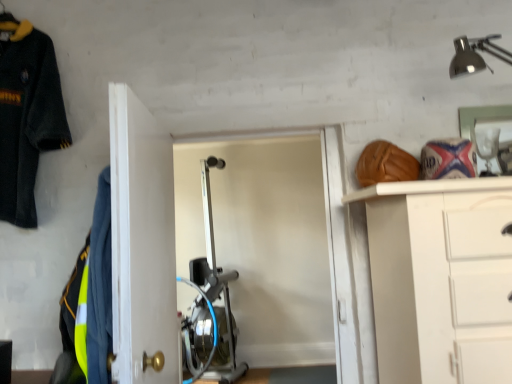
Question: Does dark blue fleece jacket at upper left, which ranks as the first uniform in back-to-front order, have a smaller size compared to reflective yellow-green fabric at left, the first uniform in the front-to-back sequence?

Choices:
 (A) no
 (B) yes

Answer: (A)

Question: Can you confirm if dark blue fleece jacket at upper left, the second uniform positioned from the right, is wider than reflective yellow-green fabric at left, the first uniform in the front-to-back sequence?

Choices:
 (A) no
 (B) yes

Answer: (B)

Question: Are dark blue fleece jacket at upper left, which ranks as the first uniform in back-to-front order, and reflective yellow-green fabric at left, the 2th uniform positioned from the back, located far from each other?

Choices:
 (A) no
 (B) yes

Answer: (A)

Question: Is dark blue fleece jacket at upper left, positioned as the first uniform in left-to-right order, looking in the opposite direction of reflective yellow-green fabric at left, the 1th uniform when ordered from right to left?

Choices:
 (A) no
 (B) yes

Answer: (A)

Question: Considering the relative positions of dark blue fleece jacket at upper left, positioned as the first uniform in left-to-right order, and reflective yellow-green fabric at left, which ranks as the second uniform in left-to-right order, in the image provided, is dark blue fleece jacket at upper left, positioned as the first uniform in left-to-right order, to the right of reflective yellow-green fabric at left, which ranks as the second uniform in left-to-right order, from the viewer's perspective?

Choices:
 (A) no
 (B) yes

Answer: (A)

Question: Would you say white glossy door at center is inside or outside reflective yellow-green fabric at left, arranged as the second uniform when viewed from the top?

Choices:
 (A) inside
 (B) outside

Answer: (B)

Question: From the image's perspective, is white glossy door at center positioned above or below reflective yellow-green fabric at left, which ranks as the second uniform in left-to-right order?

Choices:
 (A) below
 (B) above

Answer: (B)

Question: Based on their positions, is white glossy door at center located to the left or right of reflective yellow-green fabric at left, the 2th uniform positioned from the back?

Choices:
 (A) left
 (B) right

Answer: (B)

Question: From a real-world perspective, relative to reflective yellow-green fabric at left, which ranks as the second uniform in left-to-right order, is white glossy door at center vertically above or below?

Choices:
 (A) below
 (B) above

Answer: (B)

Question: Is dark blue fleece jacket at upper left, marked as the 1th uniform in a top-to-bottom arrangement, inside the boundaries of reflective yellow-green fabric at left, the first uniform when ordered from bottom to top, or outside?

Choices:
 (A) outside
 (B) inside

Answer: (A)

Question: In the image, is dark blue fleece jacket at upper left, which is the second uniform in bottom-to-top order, on the left side or the right side of reflective yellow-green fabric at left, which ranks as the second uniform in left-to-right order?

Choices:
 (A) left
 (B) right

Answer: (A)

Question: In terms of width, does dark blue fleece jacket at upper left, positioned as the first uniform in left-to-right order, look wider or thinner when compared to reflective yellow-green fabric at left, the first uniform in the front-to-back sequence?

Choices:
 (A) thin
 (B) wide

Answer: (B)

Question: Is dark blue fleece jacket at upper left, which ranks as the first uniform in back-to-front order, in front of or behind reflective yellow-green fabric at left, the first uniform when ordered from bottom to top, in the image?

Choices:
 (A) front
 (B) behind

Answer: (B)

Question: In terms of height, does white glossy door at center look taller or shorter compared to dark blue fleece jacket at upper left, marked as the 1th uniform in a top-to-bottom arrangement?

Choices:
 (A) short
 (B) tall

Answer: (B)

Question: From the image's perspective, is white glossy door at center positioned above or below dark blue fleece jacket at upper left, positioned as the first uniform in left-to-right order?

Choices:
 (A) below
 (B) above

Answer: (A)